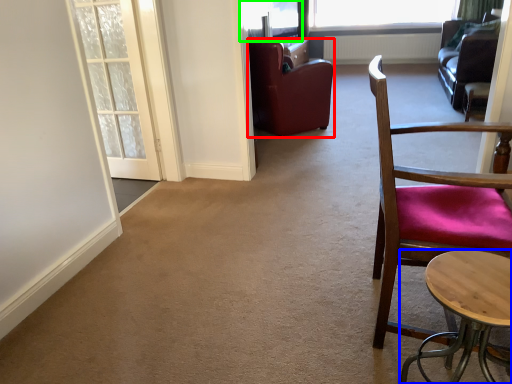
Question: Which is farther away from chair (highlighted by a red box)? table (highlighted by a blue box) or window screen (highlighted by a green box)?

Choices:
 (A) table
 (B) window screen

Answer: (A)